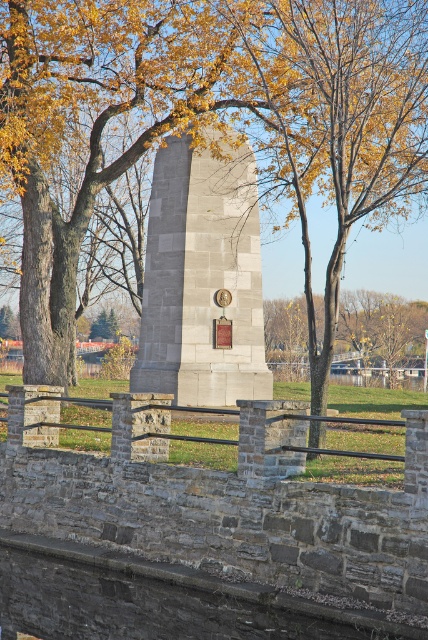
Question: Considering the relative positions of brown leafy tree at center and gold metallic clock at center in the image provided, where is brown leafy tree at center located with respect to gold metallic clock at center?

Choices:
 (A) left
 (B) right

Answer: (B)

Question: Does brown leafy tree at center have a greater width compared to gold metallic clock at center?

Choices:
 (A) no
 (B) yes

Answer: (B)

Question: Which object is positioned farthest from the brown leafy tree at center?

Choices:
 (A) gray stone monument at center
 (B) gold metallic clock at center

Answer: (B)

Question: Which point is farther to the camera?

Choices:
 (A) gray stone monument at center
 (B) gold metallic clock at center
 (C) brown leafy tree at center

Answer: (A)

Question: Which of the following is the farthest from the observer?

Choices:
 (A) (229, 296)
 (B) (91, 60)

Answer: (B)

Question: Does brown leafy tree at center appear over gray stone monument at center?

Choices:
 (A) yes
 (B) no

Answer: (A)